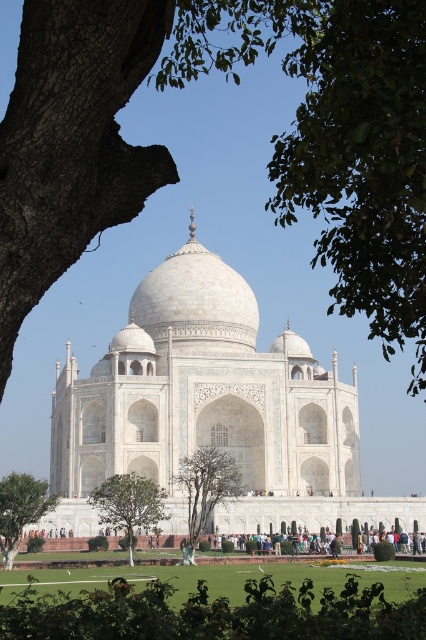
Looking at the scene of the Taj Mahal, can you tell me which object is positioned to the right of the other between the white marble taj mahal at center and the smooth bark tree at left?

The white marble taj mahal at center is positioned to the right of the smooth bark tree at left.

Looking at this image, you are planning to take a photo of the Taj Mahal with your camera. You want to include both the smooth bark tree at left and the green leafy tree at lower left in your shot. Which tree should you focus on to ensure both are in frame without zooming in too much?

The smooth bark tree at left has a lesser width compared to the green leafy tree at lower left. Therefore, focusing on the green leafy tree at lower left, which is wider, will help ensure both trees are captured in the frame without excessive zooming.

You are planning to take a photo of the white marble taj mahal at center and the smooth bark tree at left from a specific spot. The camera can capture objects within a 200 feet range. Will both objects fit in the frame if you position yourself exactly between them?

The white marble taj mahal at center and smooth bark tree at left are 199.05 feet apart. Since the camera can capture objects within a 200 feet range, positioning yourself exactly between them would mean each object is about 99.5 feet away from you. This distance is within the camera range, so both objects will fit in the frame.